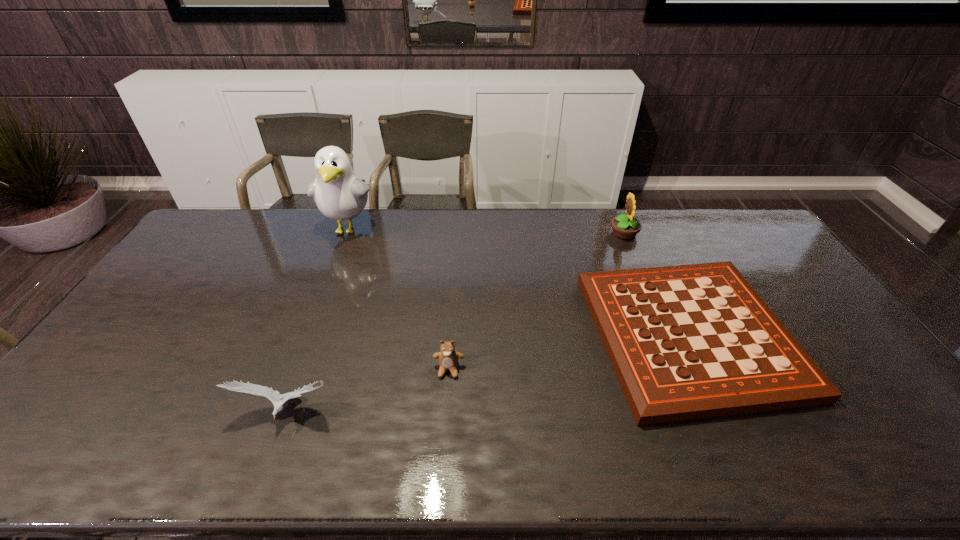
Find the location of `blank space located on the face of the sunflower`. blank space located on the face of the sunflower is located at coordinates (588, 233).

Image resolution: width=960 pixels, height=540 pixels. Identify the location of vacant space situated on the face of the sunflower. (586, 233).

Locate an element on the screen. This screenshot has height=540, width=960. vacant space located 0.150m on the front-facing side of the teddy bear is located at coordinates (444, 433).

You are a GUI agent. You are given a task and a screenshot of the screen. Output one action in this format:
    pyautogui.click(x=<x>, y=<y>)
    Task: Click on the vacant area situated on the left of the gameboard
    
    Given the screenshot: What is the action you would take?
    pyautogui.click(x=559, y=335)

In order to click on gull that is at the far edge in this screenshot , I will do `click(339, 194)`.

The height and width of the screenshot is (540, 960). Find the location of `sunflower that is at the far edge`. sunflower that is at the far edge is located at coordinates (626, 227).

I want to click on object situated at the right edge, so click(693, 341).

Locate an element on the screen. This screenshot has height=540, width=960. free space at the far edge of the desktop is located at coordinates point(383,235).

Image resolution: width=960 pixels, height=540 pixels. In the image, there is a desktop. What are the coordinates of `free space at the near edge` in the screenshot? It's located at (612, 454).

Where is `blank space at the left edge`? The width and height of the screenshot is (960, 540). blank space at the left edge is located at coordinates (176, 267).